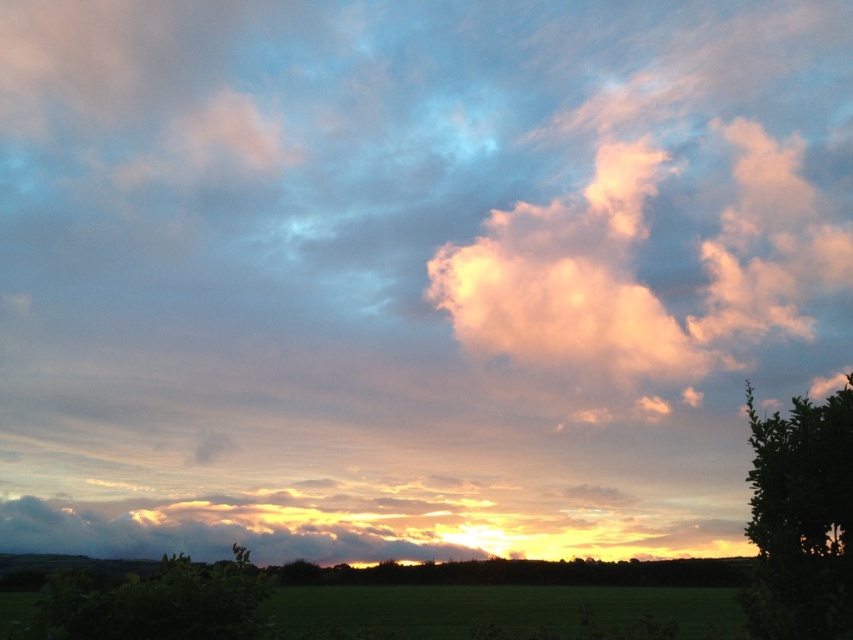
Question: Which point appears farthest from the camera in this image?

Choices:
 (A) (178, 554)
 (B) (843, 518)

Answer: (A)

Question: Can you confirm if green leafy tree at right is positioned to the left of green leafy bush at lower left?

Choices:
 (A) no
 (B) yes

Answer: (A)

Question: Which of the following is the farthest from the observer?

Choices:
 (A) (115, 620)
 (B) (833, 516)

Answer: (A)

Question: Does green leafy tree at right have a smaller size compared to green leafy bush at lower left?

Choices:
 (A) yes
 (B) no

Answer: (B)

Question: Can you confirm if green leafy tree at right is bigger than green leafy bush at lower left?

Choices:
 (A) no
 (B) yes

Answer: (B)